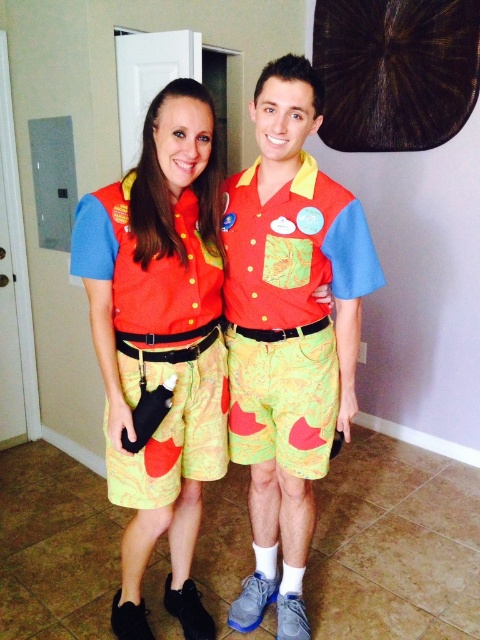
You are a costume designer trying to adjust the fit of the costume for the character from The Lion King. You notice two key components at the center of the image. Which component, the matte polyester shorts at center or the matte fabric shirt at center, has a wider width measurement?

The matte polyester shorts at center might be wider than matte fabric shirt at center according to the description provided.

You are a costume designer trying to place a belt on the matte polyester shorts at center. The belt is 0.1 meters wide. The coordinate system has the origin at the bottom left corner of the image, with x and y axes measured in meters. The shorts are located at point 0.525, 0.475. Can the belt be placed horizontally on the shorts without overlapping the edges?

The position of matte polyester shorts at center is at point (228, 336). Since the belt is 0.1 meters wide and the shorts are at the center coordinates, the belt can be placed horizontally on the shorts without overlapping the edges as long as there is sufficient space along the x or y axis. However, the exact dimensions of the shorts are not provided, so we cannot confirm overlap definitively. The answer is inconclusive based on the given information.